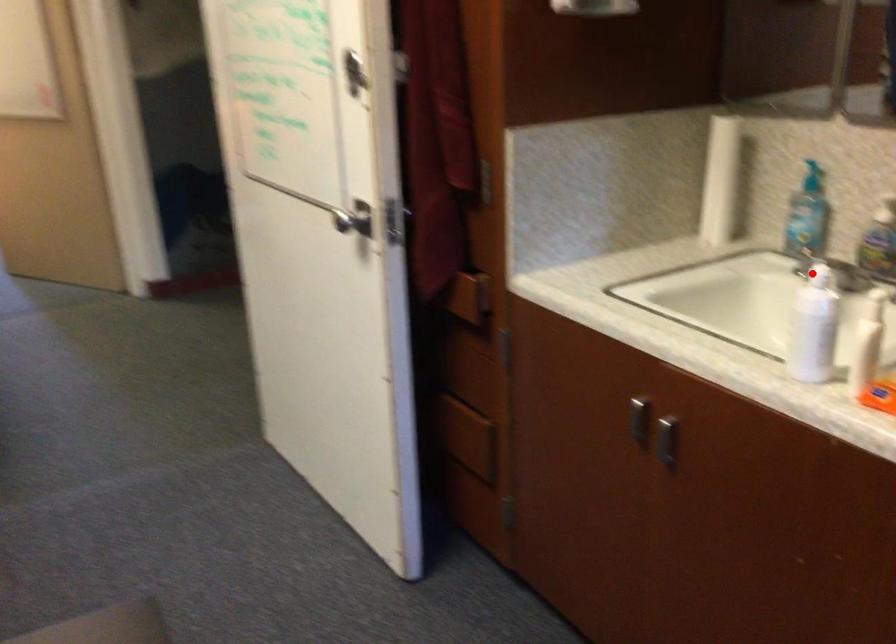
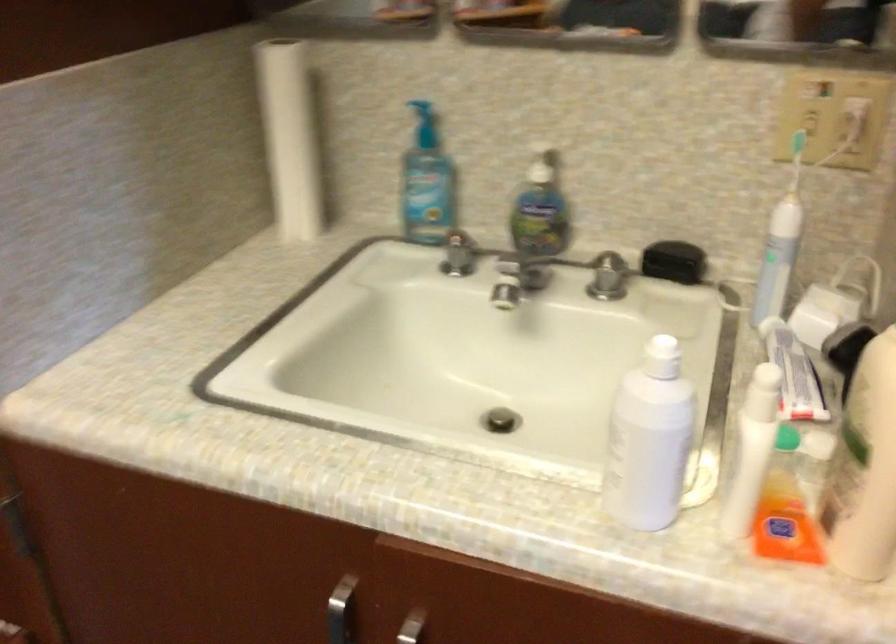
Locate, in the second image, the point that corresponds to the highlighted location in the first image.

(661, 357)